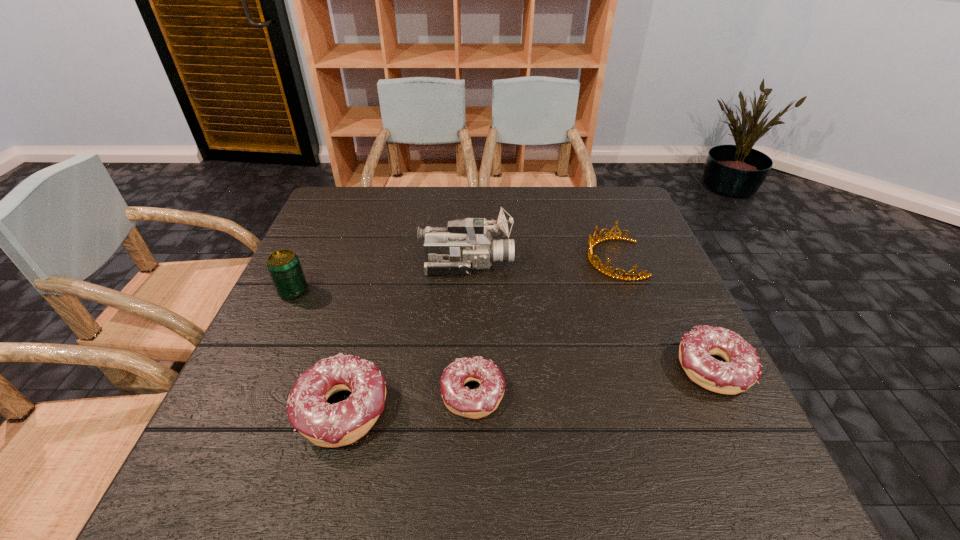
Where is `object that can be found as the second closest to the tallest object`? object that can be found as the second closest to the tallest object is located at coordinates (284, 267).

Select which object is the fifth closest to the camcorder. Please provide its 2D coordinates. Your answer should be formatted as a tuple, i.e. [(x, y)], where the tuple contains the x and y coordinates of a point satisfying the conditions above.

[(742, 369)]

Identify the location of doughnut that is the closest one to the tiara. This screenshot has width=960, height=540. (742, 369).

Identify the location of doughnut object that ranks as the closest to the camcorder. (476, 403).

Locate an element on the screen. The width and height of the screenshot is (960, 540). blank space that satisfies the following two spatial constraints: 1. on the front-facing side of the tiara; 2. on the back side of the fifth tallest object is located at coordinates pos(654,368).

Locate an element on the screen. The image size is (960, 540). vacant space that satisfies the following two spatial constraints: 1. on the back side of the second shortest doughnut; 2. on the front-facing side of the tiara is located at coordinates (659, 259).

Locate an element on the screen. Image resolution: width=960 pixels, height=540 pixels. vacant space that satisfies the following two spatial constraints: 1. on the back side of the second object from left to right; 2. on the left side of the shortest object is located at coordinates (347, 395).